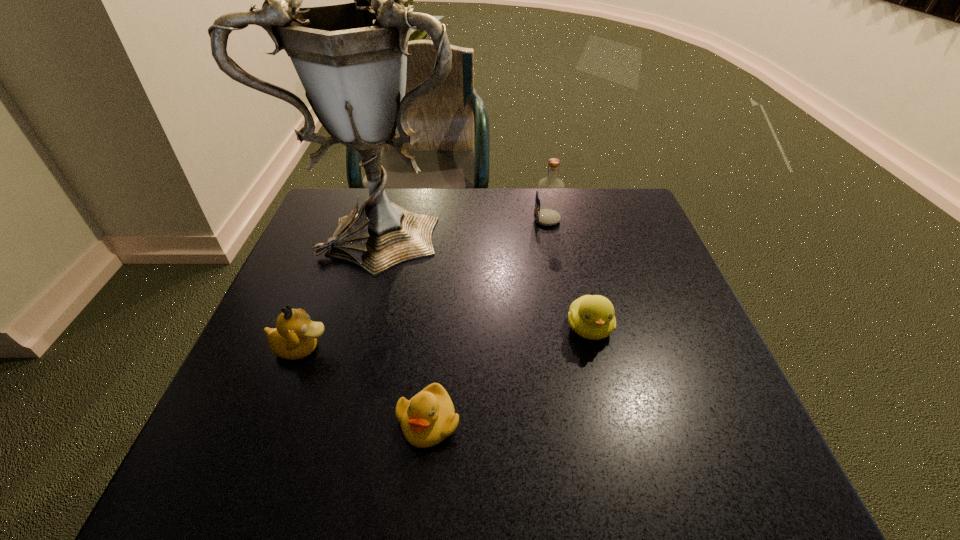
Where is `free space between the vodka and the tallest object`? The width and height of the screenshot is (960, 540). free space between the vodka and the tallest object is located at coordinates (467, 224).

The image size is (960, 540). What are the coordinates of `free space between the second tallest duckling and the vodka` in the screenshot? It's located at (568, 274).

Image resolution: width=960 pixels, height=540 pixels. Identify the location of free area in between the leftmost duckling and the nearest object. (365, 384).

Where is `free space between the tallest object and the second tallest duckling`? The image size is (960, 540). free space between the tallest object and the second tallest duckling is located at coordinates (488, 278).

Identify the location of free space between the second shortest object and the vodka. The image size is (960, 540). (568, 274).

Identify which object is the second nearest to the tallest object. Please provide its 2D coordinates. Your answer should be formatted as a tuple, i.e. [(x, y)], where the tuple contains the x and y coordinates of a point satisfying the conditions above.

[(550, 190)]

Identify which object is the closest to the trophy cup. Please provide its 2D coordinates. Your answer should be formatted as a tuple, i.e. [(x, y)], where the tuple contains the x and y coordinates of a point satisfying the conditions above.

[(295, 337)]

Locate which duckling ranks second in proximity to the leftmost duckling. Please provide its 2D coordinates. Your answer should be formatted as a tuple, i.e. [(x, y)], where the tuple contains the x and y coordinates of a point satisfying the conditions above.

[(591, 316)]

Select which duckling appears as the second closest to the leftmost duckling. Please provide its 2D coordinates. Your answer should be formatted as a tuple, i.e. [(x, y)], where the tuple contains the x and y coordinates of a point satisfying the conditions above.

[(591, 316)]

This screenshot has height=540, width=960. I want to click on vacant position in the image that satisfies the following two spatial constraints: 1. on the label of the second tallest object; 2. on the front side of the trophy cup, so click(548, 227).